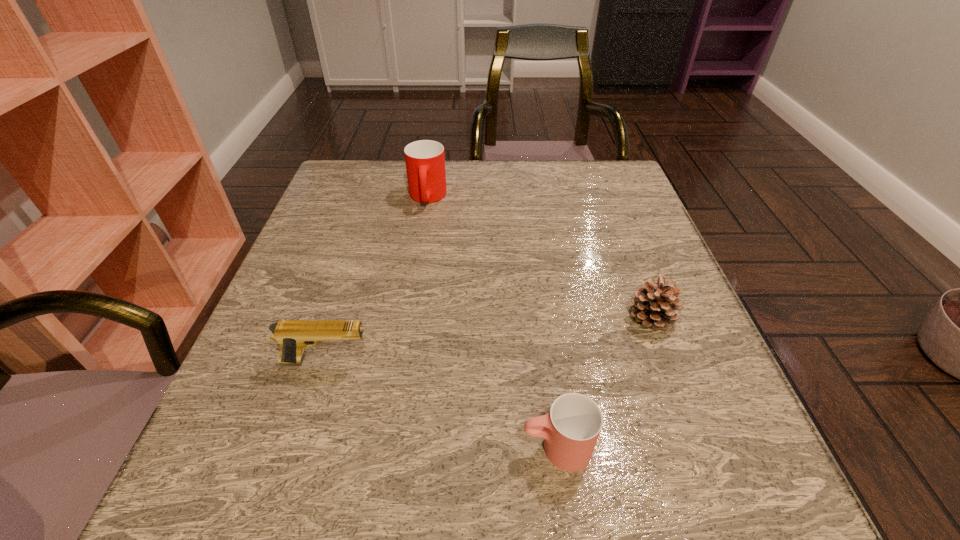
The width and height of the screenshot is (960, 540). I want to click on the farthest object, so click(x=425, y=160).

Locate an element on the screen. the second object from left to right is located at coordinates (425, 160).

At what (x,y) coordinates should I click in order to perform the action: click on pinecone. Please return your answer as a coordinate pair (x, y). The height and width of the screenshot is (540, 960). Looking at the image, I should click on (655, 305).

This screenshot has height=540, width=960. I want to click on the second farthest object, so click(655, 305).

Locate an element on the screen. This screenshot has width=960, height=540. pistol is located at coordinates (293, 336).

At what (x,y) coordinates should I click in order to perform the action: click on the leftmost object. Please return your answer as a coordinate pair (x, y). This screenshot has width=960, height=540. Looking at the image, I should click on (293, 336).

Find the location of a particular element. The width and height of the screenshot is (960, 540). the third object from left to right is located at coordinates (571, 428).

Where is `the shorter cup`? This screenshot has width=960, height=540. the shorter cup is located at coordinates (571, 428).

You are a GUI agent. You are given a task and a screenshot of the screen. Output one action in this format:
    pyautogui.click(x=<x>, y=<y>)
    Task: Click on the vacant space situated on the side of the tallest object with the handle
    This screenshot has height=540, width=960.
    Given the screenshot: What is the action you would take?
    (x=421, y=236)

This screenshot has height=540, width=960. I want to click on vacant area located on the back of the pinecone, so click(x=626, y=247).